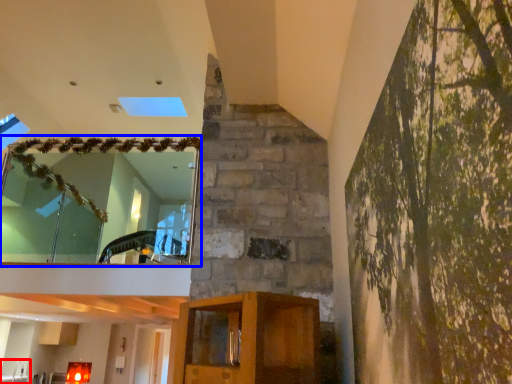
Question: Which object appears farthest to the camera in this image, sink (highlighted by a red box) or window (highlighted by a blue box)?

Choices:
 (A) sink
 (B) window

Answer: (A)